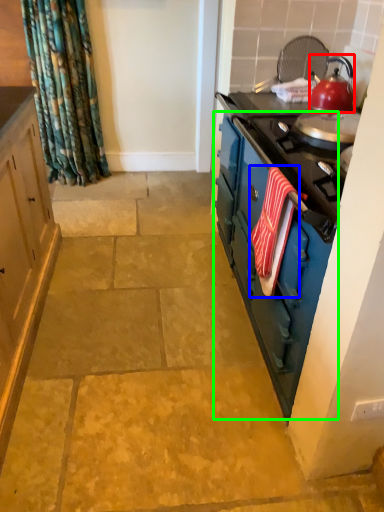
Question: Based on their relative distances, which object is farther from kitchen appliance (highlighted by a red box)? Choose from beach towel (highlighted by a blue box) and dresser (highlighted by a green box).

Choices:
 (A) beach towel
 (B) dresser

Answer: (A)